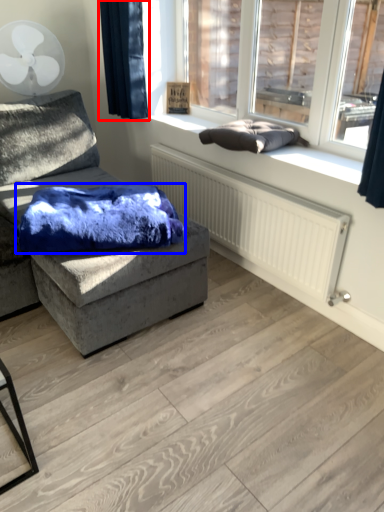
Question: Which object appears closest to the camera in this image, curtain (highlighted by a red box) or material (highlighted by a blue box)?

Choices:
 (A) curtain
 (B) material

Answer: (B)